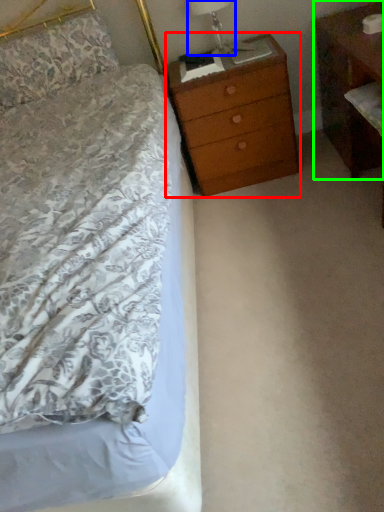
Question: Which object is positioned farthest from chest of drawers (highlighted by a red box)? Select from bedside lamp (highlighted by a blue box) and nightstand (highlighted by a green box).

Choices:
 (A) bedside lamp
 (B) nightstand

Answer: (B)